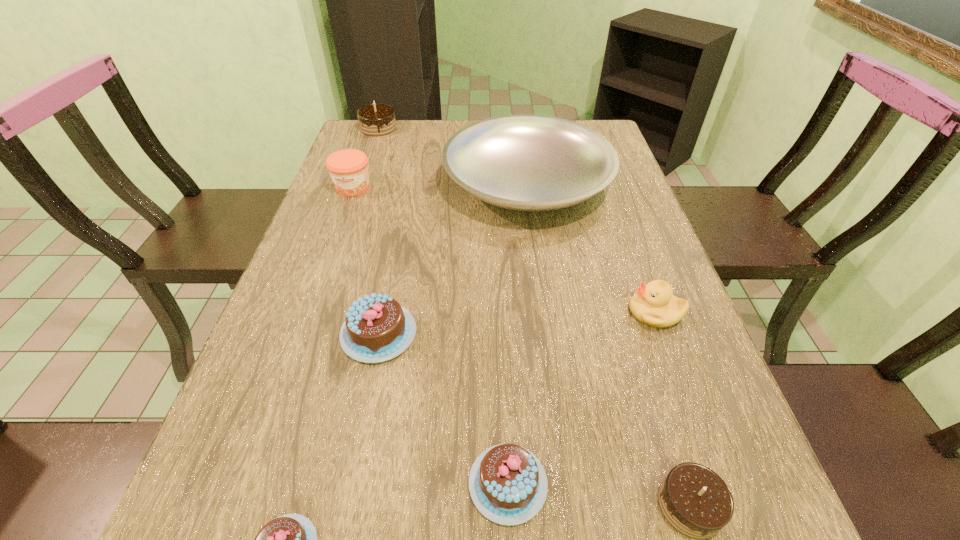
At what (x,y) coordinates should I click in order to perform the action: click on the fourth closest chocolate cake to the rightmost chocolate cake. Please return your answer as a coordinate pair (x, y). The image size is (960, 540). Looking at the image, I should click on (375, 119).

Point out which chocolate cake is positioned as the second nearest to the nearer chocolate chocolate cake. Please provide its 2D coordinates. Your answer should be formatted as a tuple, i.e. [(x, y)], where the tuple contains the x and y coordinates of a point satisfying the conditions above.

[(377, 328)]

Find the location of a particular element. pink chocolate cake that is the second closest one to the biggest pink chocolate cake is located at coordinates (291, 539).

Choose which pink chocolate cake is the nearest neighbor to the farthest pink chocolate cake. Please provide its 2D coordinates. Your answer should be formatted as a tuple, i.e. [(x, y)], where the tuple contains the x and y coordinates of a point satisfying the conditions above.

[(508, 484)]

Locate an element on the screen. The image size is (960, 540). free location that satisfies the following two spatial constraints: 1. on the front label of the smaller chocolate chocolate cake; 2. on the right side of the jam is located at coordinates (238, 505).